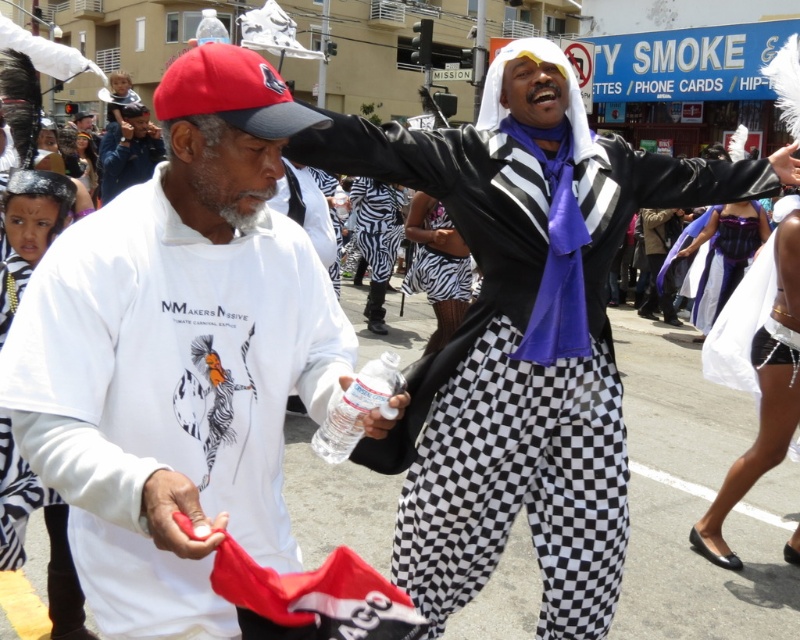
Is white matte t-shirt at center above zebra print pants at center?

No, white matte t-shirt at center is not above zebra print pants at center.

Looking at this image, does white matte t-shirt at center appear on the left side of zebra print pants at center?

Correct, you'll find white matte t-shirt at center to the left of zebra print pants at center.

This screenshot has height=640, width=800. I want to click on white matte t-shirt at center, so click(178, 355).

Who is more distant from viewer, (414, 456) or (454, 266)?

The point (454, 266) is more distant.

Is matte black jacket at center to the right of zebra print pants at center from the viewer's perspective?

Indeed, matte black jacket at center is positioned on the right side of zebra print pants at center.

You are a GUI agent. You are given a task and a screenshot of the screen. Output one action in this format:
    pyautogui.click(x=<x>, y=<y>)
    Task: Click on the matte black jacket at center
    Image resolution: width=800 pixels, height=640 pixels.
    Given the screenshot: What is the action you would take?
    pyautogui.click(x=524, y=339)

Can you confirm if white matte t-shirt at center is positioned to the left of matte black jacket at center?

Yes, white matte t-shirt at center is to the left of matte black jacket at center.

Which is below, white matte t-shirt at center or matte black jacket at center?

white matte t-shirt at center is lower down.

The width and height of the screenshot is (800, 640). What do you see at coordinates (178, 355) in the screenshot?
I see `white matte t-shirt at center` at bounding box center [178, 355].

What are the coordinates of `white matte t-shirt at center` in the screenshot? It's located at (178, 355).